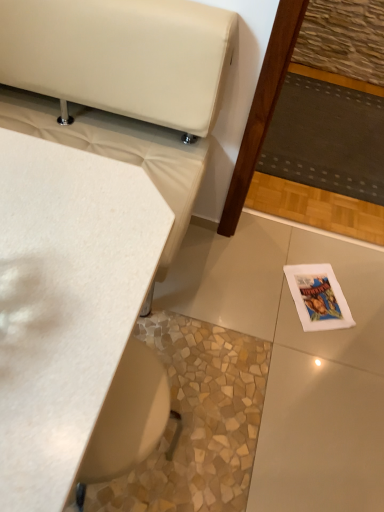
The width and height of the screenshot is (384, 512). In order to click on vacant location below dark gray fabric mat at center right (from a real-world perspective) in this screenshot , I will do `click(330, 132)`.